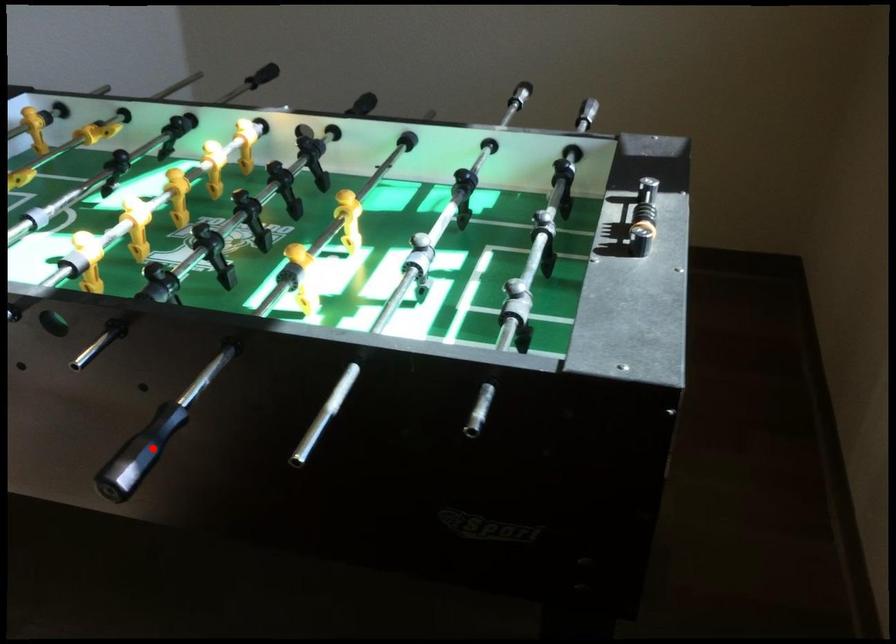
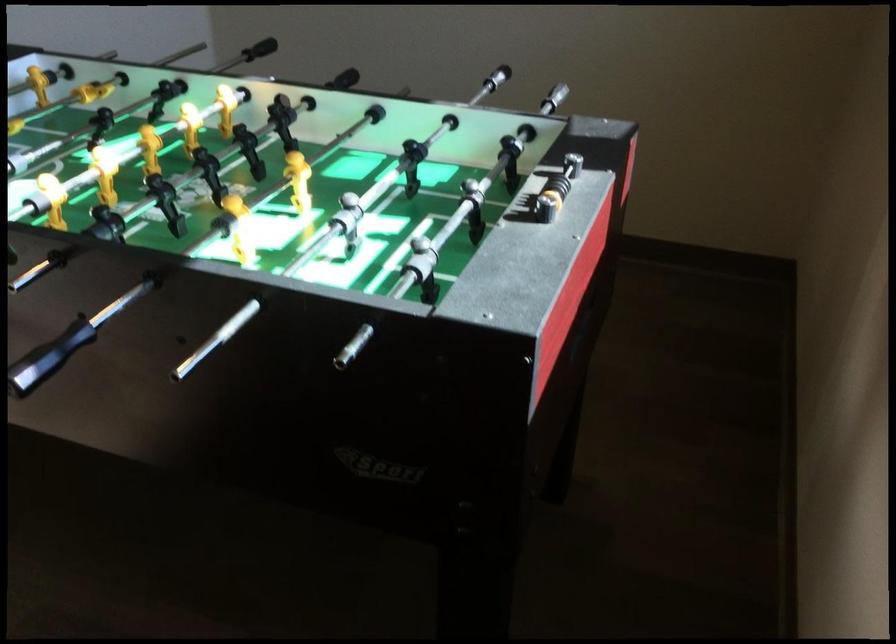
Where in the second image is the point corresponding to the highlighted location from the first image?

(48, 357)